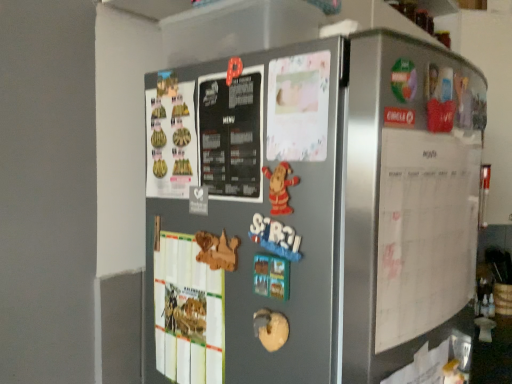
Question: Considering the positions of satin silver fridge at center and white paper calendar at right in the image, is satin silver fridge at center wider or thinner than white paper calendar at right?

Choices:
 (A) thin
 (B) wide

Answer: (B)

Question: From the image's perspective, relative to white paper calendar at right, is satin silver fridge at center above or below?

Choices:
 (A) above
 (B) below

Answer: (B)

Question: Is satin silver fridge at center to the left or to the right of white paper calendar at right in the image?

Choices:
 (A) right
 (B) left

Answer: (B)

Question: From the image's perspective, is white paper calendar at right located above or below satin silver fridge at center?

Choices:
 (A) above
 (B) below

Answer: (A)

Question: Visually, is white paper calendar at right positioned to the left or to the right of satin silver fridge at center?

Choices:
 (A) left
 (B) right

Answer: (B)

Question: Is white paper calendar at right bigger or smaller than satin silver fridge at center?

Choices:
 (A) big
 (B) small

Answer: (B)

Question: From a real-world perspective, is white paper calendar at right physically located above or below satin silver fridge at center?

Choices:
 (A) below
 (B) above

Answer: (B)